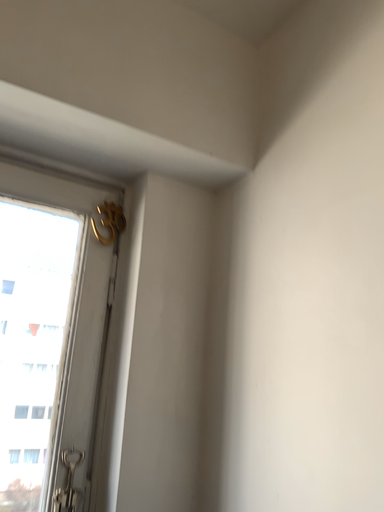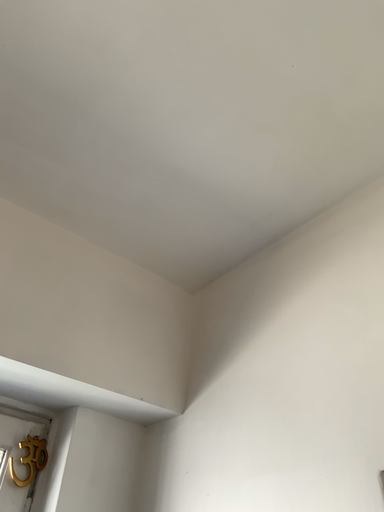
Question: Which way did the camera rotate in the video?

Choices:
 (A) rotated downward
 (B) rotated upward

Answer: (B)